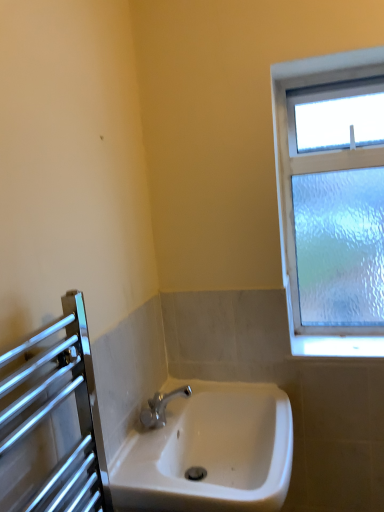
Question: In the image, is white ceramic sink at center positioned in front of or behind clear glass window at upper right?

Choices:
 (A) front
 (B) behind

Answer: (A)

Question: From a real-world perspective, is white ceramic sink at center positioned above or below clear glass window at upper right?

Choices:
 (A) above
 (B) below

Answer: (B)

Question: Does point [256, 488] appear closer or farther from the camera than point [377, 243]?

Choices:
 (A) closer
 (B) farther

Answer: (A)

Question: From a real-world perspective, is clear glass window at upper right physically located above or below white ceramic sink at center?

Choices:
 (A) above
 (B) below

Answer: (A)

Question: Considering the positions of point click(337, 287) and point click(160, 443), is point click(337, 287) closer or farther from the camera than point click(160, 443)?

Choices:
 (A) farther
 (B) closer

Answer: (A)

Question: From the image's perspective, relative to white ceramic sink at center, is clear glass window at upper right above or below?

Choices:
 (A) below
 (B) above

Answer: (B)

Question: Is clear glass window at upper right wider or thinner than white ceramic sink at center?

Choices:
 (A) thin
 (B) wide

Answer: (A)